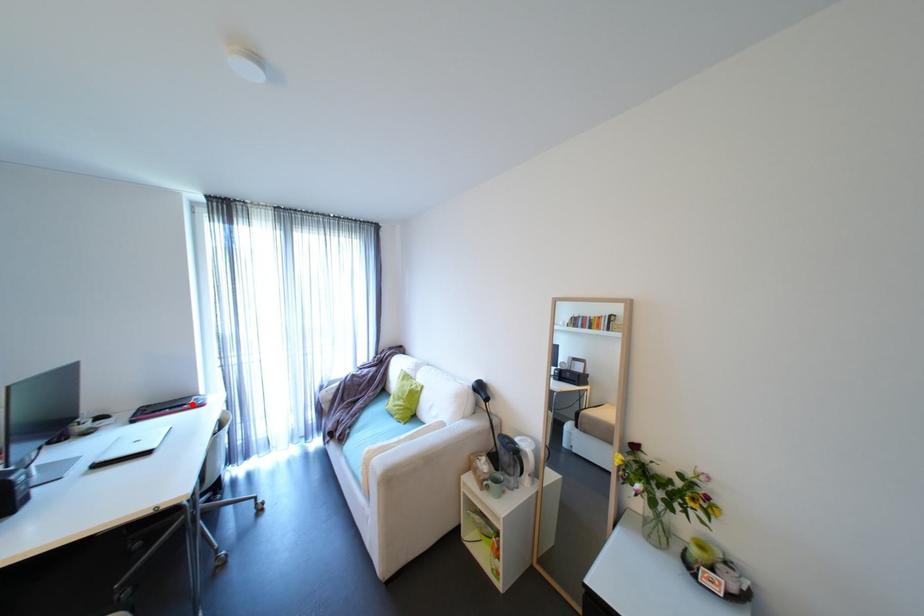
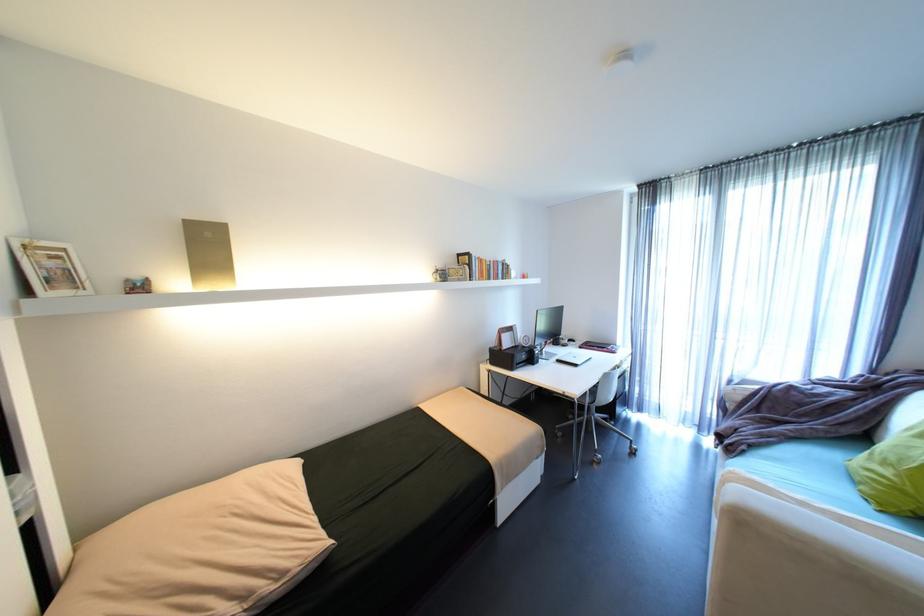
Find the pixel in the second image that matches the highlighted location in the first image.

(612, 347)